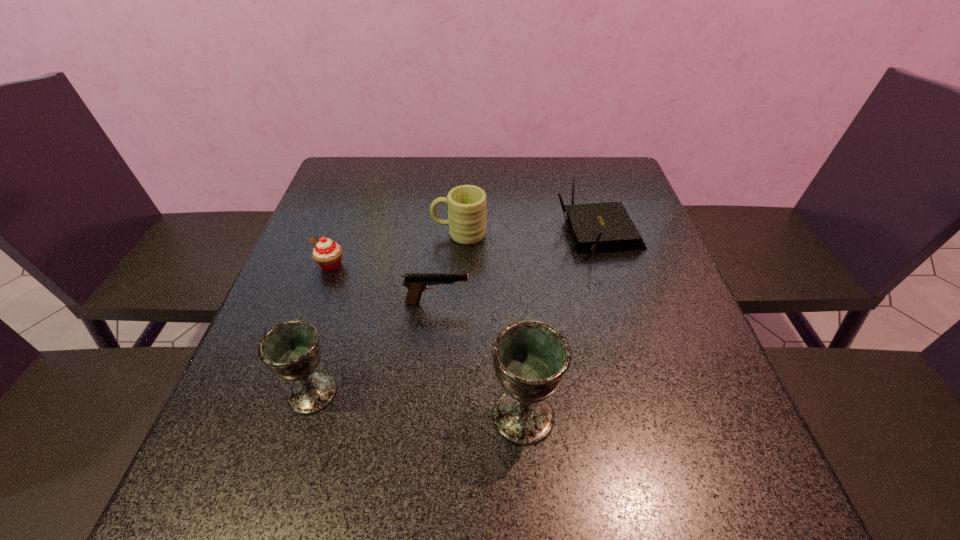
This screenshot has height=540, width=960. I want to click on vacant area that satisfies the following two spatial constraints: 1. on the back side of the shorter chalice; 2. on the right side of the router, so click(x=362, y=233).